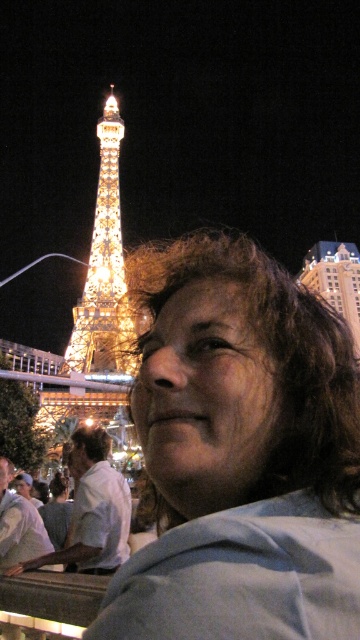
You are a photographer trying to capture the illuminated glass Eiffel Tower at upper left and the white cotton shirt at center. Which object appears narrower in the photo?

The illuminated glass Eiffel Tower at upper left appears narrower than the white cotton shirt at center in the photo.

You are taking a photo of the Eiffel Tower replica at night. You notice two points in the image labeled as point (87,493) and point (299,282). Which point is nearer to your camera?

Point (87,493) is closer to the camera than point (299,282).